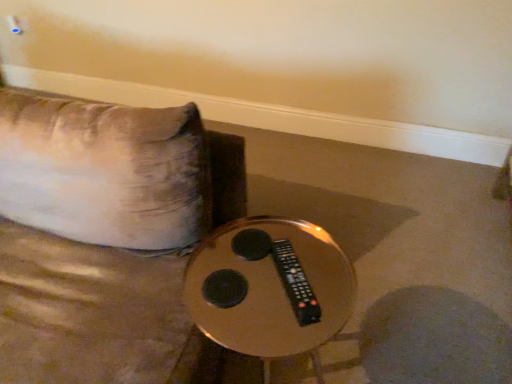
The width and height of the screenshot is (512, 384). In order to click on unoccupied area in front of black plastic remote at center in this screenshot , I will do `click(291, 323)`.